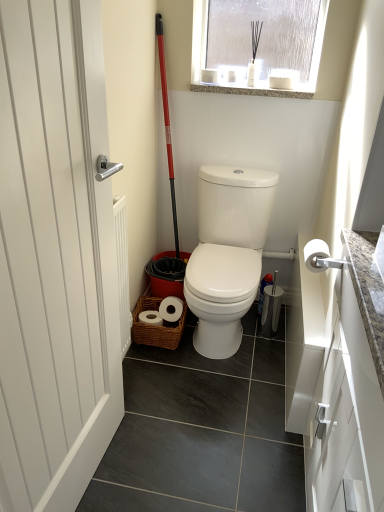
Question: Considering the positions of point (13, 407) and point (200, 83), is point (13, 407) closer or farther from the camera than point (200, 83)?

Choices:
 (A) closer
 (B) farther

Answer: (A)

Question: Based on their sizes in the image, would you say white matte door at left is bigger or smaller than granite at upper center?

Choices:
 (A) big
 (B) small

Answer: (A)

Question: Estimate the real-world distances between objects in this image. Which object is closer to the granite at upper center?

Choices:
 (A) frosted glass window at upper center
 (B) white matte door at left
 (C) white matte toilet paper at right
 (D) white glossy toilet at center

Answer: (A)

Question: Which object is the farthest from the frosted glass window at upper center?

Choices:
 (A) granite at upper center
 (B) white glossy toilet at center
 (C) white matte door at left
 (D) white matte toilet paper at right

Answer: (C)